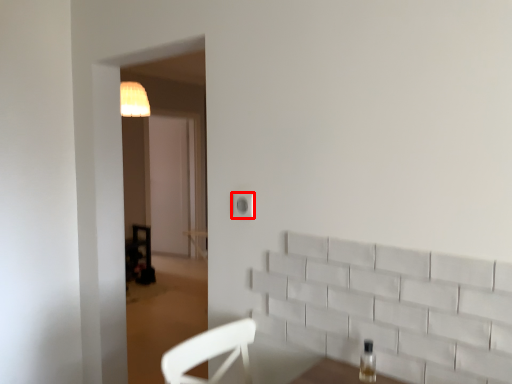
Question: From the image's perspective, where is electric outlet (annotated by the red box) located in relation to bottle in the image?

Choices:
 (A) above
 (B) below

Answer: (A)